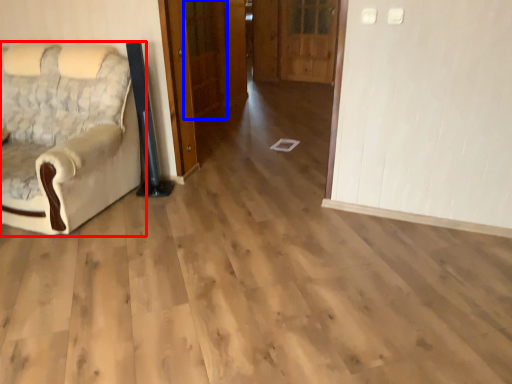
Question: Among these objects, which one is nearest to the camera, chair (highlighted by a red box) or door (highlighted by a blue box)?

Choices:
 (A) chair
 (B) door

Answer: (A)